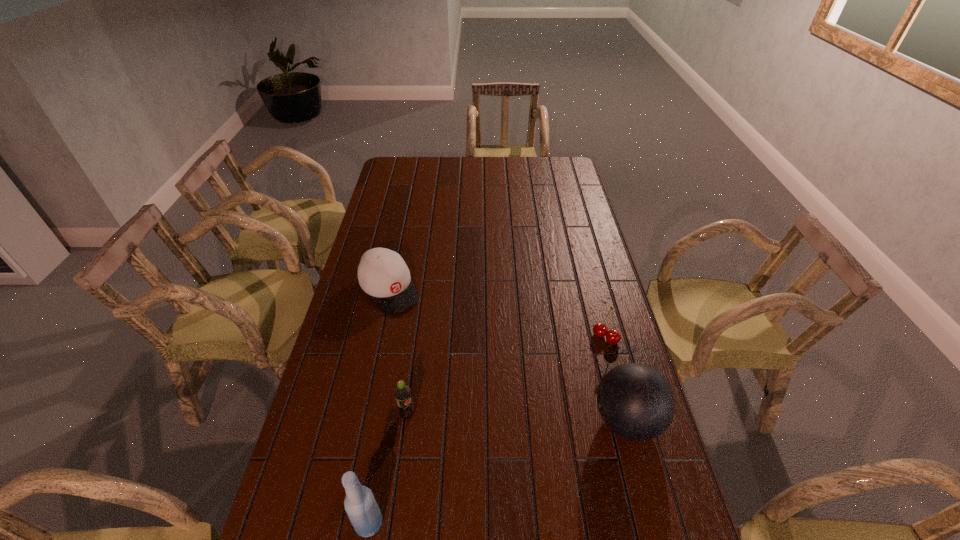
Locate an element on the screen. object present at the left edge is located at coordinates (382, 273).

You are a GUI agent. You are given a task and a screenshot of the screen. Output one action in this format:
    pyautogui.click(x=<x>, y=<y>)
    Task: Click on the bowling ball that is at the right edge
    This screenshot has width=960, height=540.
    Given the screenshot: What is the action you would take?
    pyautogui.click(x=636, y=402)

Image resolution: width=960 pixels, height=540 pixels. What are the coordinates of `cherry present at the right edge` in the screenshot? It's located at (600, 330).

The height and width of the screenshot is (540, 960). In order to click on vacant space at the far edge of the desktop in this screenshot , I will do `click(506, 177)`.

I want to click on blank space at the left edge of the desktop, so click(396, 231).

Locate an element on the screen. The height and width of the screenshot is (540, 960). vacant space at the right edge is located at coordinates (638, 455).

This screenshot has width=960, height=540. In the image, there is a desktop. Find the location of `blank space at the far left corner`. blank space at the far left corner is located at coordinates (390, 160).

What are the coordinates of `free space at the far right corner of the desktop` in the screenshot? It's located at (562, 157).

This screenshot has width=960, height=540. I want to click on free spot between the second farthest object and the soda, so click(x=506, y=376).

Locate an element on the screen. This screenshot has height=540, width=960. empty location between the nearest object and the soda is located at coordinates (388, 469).